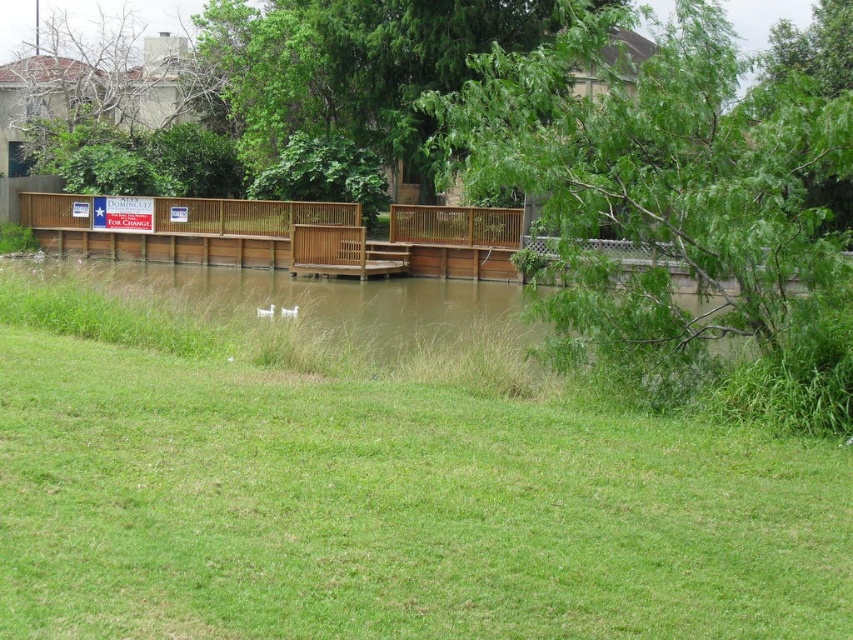
You are standing at the origin point of the image. Which direction should you move to reach the green leafy tree at upper right?

The green leafy tree at upper right is located at coordinates point (659, 184), so you should move towards the upper right direction to reach it.

You are standing on the wooden dock in the middle ground and want to determine which tree is taller between the green leafy tree at upper right and the green leafy tree at upper center. Based on their positions in the scene, which tree would appear taller to you?

The green leafy tree at upper right appears taller than the green leafy tree at upper center because it has a greater height according to their positions in the scene.

You are standing on the green grass at center and want to reach the green leafy tree at upper right. Which direction should you walk to get closer to the tree?

The green grass at center is smaller in size compared to the green leafy tree at upper right, so you should walk towards the upper right direction to get closer to the tree.